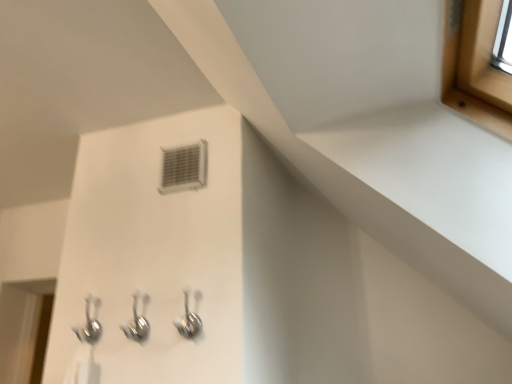
Question: Is satin nickel hooks at center, positioned as the 1th plumbing fixture in right-to-left order, next to polished chrome hooks at lower center, which ranks as the second plumbing fixture in right-to-left order, and touching it?

Choices:
 (A) yes
 (B) no

Answer: (B)

Question: Is satin nickel hooks at center, which ranks as the third plumbing fixture in left-to-right order, positioned before polished chrome hooks at lower center, the 2th plumbing fixture viewed from the left?

Choices:
 (A) no
 (B) yes

Answer: (B)

Question: Considering the relative positions of satin nickel hooks at center, which ranks as the third plumbing fixture in left-to-right order, and polished chrome hooks at lower center, which ranks as the second plumbing fixture in right-to-left order, in the image provided, is satin nickel hooks at center, which ranks as the third plumbing fixture in left-to-right order, to the right of polished chrome hooks at lower center, which ranks as the second plumbing fixture in right-to-left order, from the viewer's perspective?

Choices:
 (A) yes
 (B) no

Answer: (A)

Question: From a real-world perspective, is satin nickel hooks at center, positioned as the 1th plumbing fixture in right-to-left order, located higher than polished chrome hooks at lower center, which ranks as the second plumbing fixture in right-to-left order?

Choices:
 (A) yes
 (B) no

Answer: (A)

Question: Does satin nickel hooks at center, which ranks as the third plumbing fixture in left-to-right order, contain polished chrome hooks at lower center, which ranks as the second plumbing fixture in right-to-left order?

Choices:
 (A) yes
 (B) no

Answer: (B)

Question: Is point (91, 319) positioned closer to the camera than point (136, 306)?

Choices:
 (A) closer
 (B) farther

Answer: (B)

Question: Is polished chrome hooks at lower left, which is the first plumbing fixture from left to right, inside or outside of polished chrome hooks at lower center, which ranks as the second plumbing fixture in right-to-left order?

Choices:
 (A) outside
 (B) inside

Answer: (A)

Question: Based on their sizes in the image, would you say polished chrome hooks at lower left, arranged as the third plumbing fixture when viewed from the right, is bigger or smaller than polished chrome hooks at lower center, which ranks as the second plumbing fixture in right-to-left order?

Choices:
 (A) big
 (B) small

Answer: (B)

Question: Considering the positions of polished chrome hooks at lower left, arranged as the third plumbing fixture when viewed from the right, and polished chrome hooks at lower center, the 2th plumbing fixture viewed from the left, in the image, is polished chrome hooks at lower left, arranged as the third plumbing fixture when viewed from the right, wider or thinner than polished chrome hooks at lower center, the 2th plumbing fixture viewed from the left,?

Choices:
 (A) thin
 (B) wide

Answer: (B)

Question: Is white plastic air conditioning at center in front of or behind polished chrome hooks at lower center, which ranks as the second plumbing fixture in right-to-left order, in the image?

Choices:
 (A) front
 (B) behind

Answer: (B)

Question: From a real-world perspective, relative to polished chrome hooks at lower center, which ranks as the second plumbing fixture in right-to-left order, is white plastic air conditioning at center vertically above or below?

Choices:
 (A) above
 (B) below

Answer: (A)

Question: Is white plastic air conditioning at center situated inside polished chrome hooks at lower center, the 2th plumbing fixture viewed from the left, or outside?

Choices:
 (A) inside
 (B) outside

Answer: (B)

Question: From the image's perspective, is white plastic air conditioning at center above or below polished chrome hooks at lower center, the 2th plumbing fixture viewed from the left?

Choices:
 (A) below
 (B) above

Answer: (B)

Question: Looking at the image, does white plastic air conditioning at center seem bigger or smaller compared to polished chrome hooks at lower left, arranged as the third plumbing fixture when viewed from the right?

Choices:
 (A) small
 (B) big

Answer: (A)

Question: From a real-world perspective, relative to polished chrome hooks at lower left, arranged as the third plumbing fixture when viewed from the right, is white plastic air conditioning at center vertically above or below?

Choices:
 (A) above
 (B) below

Answer: (A)